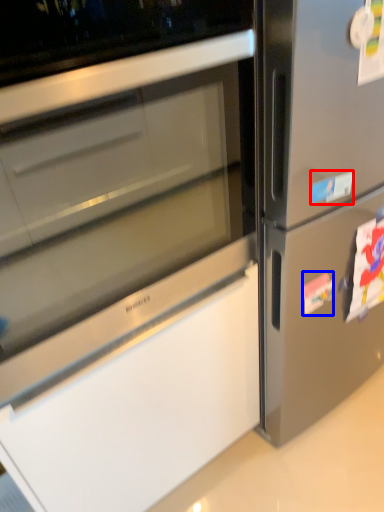
Question: Which of the following is the closest to the observer, sticker (highlighted by a red box) or sticker (highlighted by a blue box)?

Choices:
 (A) sticker
 (B) sticker

Answer: (A)